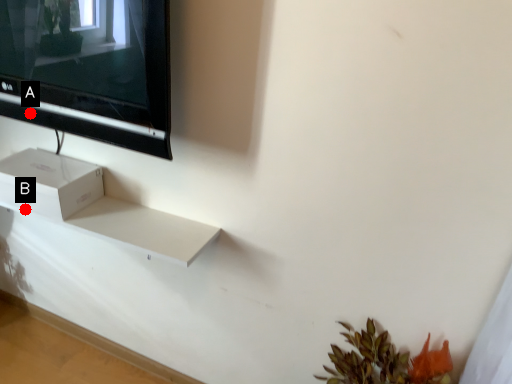
Question: Two points are circled on the image, labeled by A and B beside each circle. Which point is closer to the camera?

Choices:
 (A) A is closer
 (B) B is closer

Answer: (A)